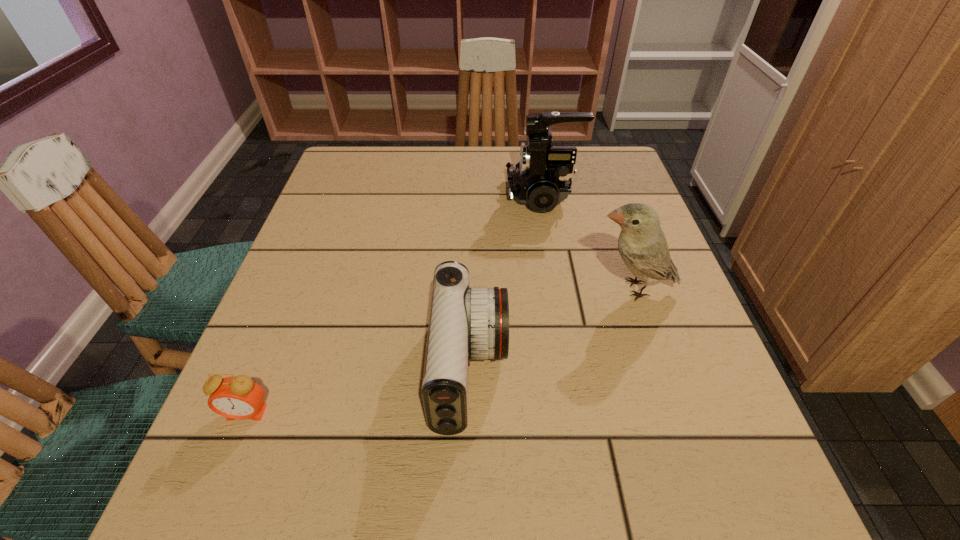
Where is `vacant space that satisfies the following two spatial constraints: 1. at the face of the second farthest object; 2. on the face of the alarm clock`? Image resolution: width=960 pixels, height=540 pixels. vacant space that satisfies the following two spatial constraints: 1. at the face of the second farthest object; 2. on the face of the alarm clock is located at coordinates coord(674,413).